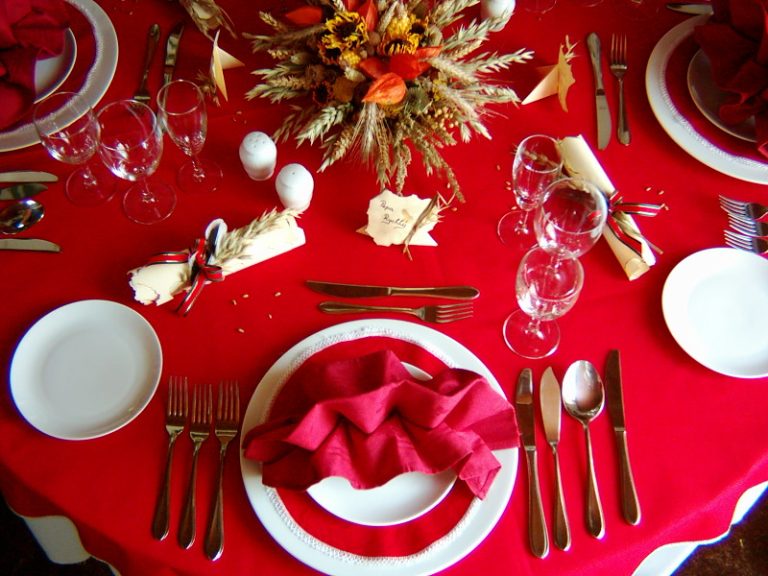
This screenshot has width=768, height=576. I want to click on plates, so click(116, 389), click(63, 74), click(94, 71), click(339, 338), click(363, 502), click(707, 329), click(696, 137), click(713, 101).